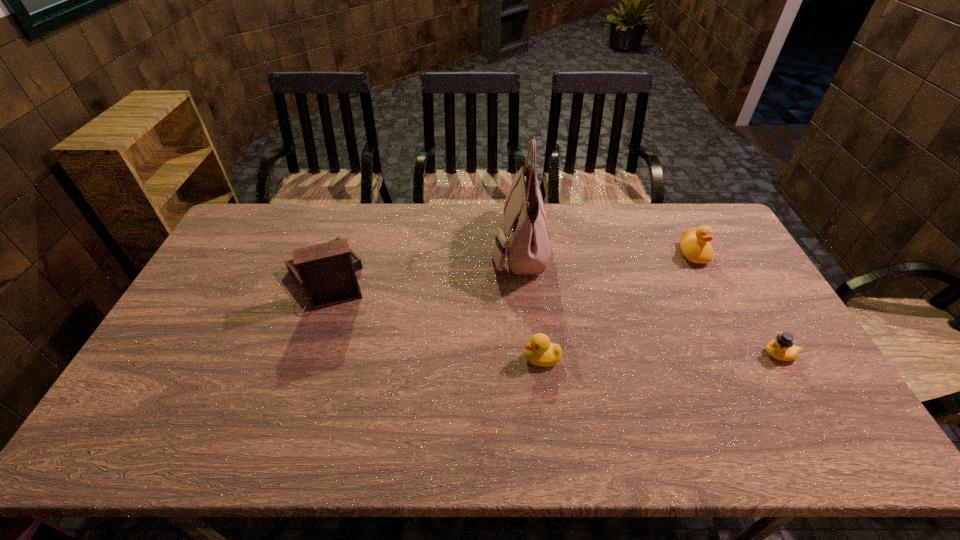
Where is `handbag that is at the far edge`? This screenshot has width=960, height=540. handbag that is at the far edge is located at coordinates (526, 242).

What are the coordinates of `duck that is at the far edge` in the screenshot? It's located at (694, 243).

The width and height of the screenshot is (960, 540). In order to click on object at the far right corner in this screenshot , I will do `click(694, 243)`.

This screenshot has height=540, width=960. I want to click on vacant space at the far edge of the desktop, so click(581, 213).

What are the coordinates of `vacant space at the near edge of the desktop` in the screenshot? It's located at (293, 455).

Identify the location of blank space at the left edge. The height and width of the screenshot is (540, 960). pyautogui.click(x=248, y=255).

The image size is (960, 540). What are the coordinates of `free space at the right edge of the desktop` in the screenshot? It's located at pyautogui.click(x=768, y=325).

You are a GUI agent. You are given a task and a screenshot of the screen. Output one action in this format:
    pyautogui.click(x=<x>, y=<y>)
    Task: Click on the unoccupied area between the handbag and the rightmost duck
    This screenshot has height=540, width=960.
    Given the screenshot: What is the action you would take?
    pyautogui.click(x=649, y=300)

Locate an element on the screen. free area in between the second object from right to left and the handbag is located at coordinates (606, 250).

The image size is (960, 540). What are the coordinates of `vacant point located between the rightmost duck and the fourth tallest object` in the screenshot? It's located at (660, 356).